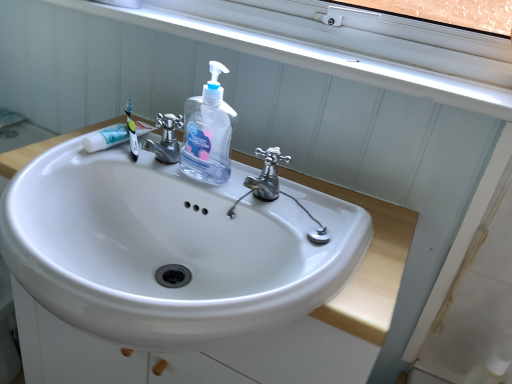
Question: Is black plastic toothbrush at upper left shorter than polished chrome tap at center, arranged as the 1th tap when viewed from the right?

Choices:
 (A) no
 (B) yes

Answer: (B)

Question: Considering the relative positions of black plastic toothbrush at upper left and polished chrome tap at center, placed as the second tap when sorted from left to right, in the image provided, is black plastic toothbrush at upper left to the right of polished chrome tap at center, placed as the second tap when sorted from left to right, from the viewer's perspective?

Choices:
 (A) no
 (B) yes

Answer: (A)

Question: Can you confirm if black plastic toothbrush at upper left is smaller than polished chrome tap at center, arranged as the 1th tap when viewed from the right?

Choices:
 (A) no
 (B) yes

Answer: (B)

Question: Does black plastic toothbrush at upper left lie behind polished chrome tap at center, arranged as the 1th tap when viewed from the right?

Choices:
 (A) no
 (B) yes

Answer: (B)

Question: Is polished chrome tap at center, arranged as the 1th tap when viewed from the right, surrounded by black plastic toothbrush at upper left?

Choices:
 (A) no
 (B) yes

Answer: (A)

Question: Is black plastic toothbrush at upper left taller than polished chrome tap at center, placed as the second tap when sorted from left to right?

Choices:
 (A) no
 (B) yes

Answer: (A)

Question: Is white plastic window sill at upper center positioned beyond the bounds of polished chrome tap at center, arranged as the 1th tap when viewed from the right?

Choices:
 (A) yes
 (B) no

Answer: (A)

Question: Does white plastic window sill at upper center have a smaller size compared to polished chrome tap at center, placed as the second tap when sorted from left to right?

Choices:
 (A) yes
 (B) no

Answer: (B)

Question: Is white plastic window sill at upper center facing towards polished chrome tap at center, arranged as the 1th tap when viewed from the right?

Choices:
 (A) no
 (B) yes

Answer: (A)

Question: Can polished chrome tap at center, placed as the second tap when sorted from left to right, be found inside white plastic window sill at upper center?

Choices:
 (A) no
 (B) yes

Answer: (A)

Question: Is white plastic window sill at upper center turned away from polished chrome tap at center, arranged as the 1th tap when viewed from the right?

Choices:
 (A) no
 (B) yes

Answer: (A)

Question: Does white plastic window sill at upper center have a lesser height compared to polished chrome tap at center, arranged as the 1th tap when viewed from the right?

Choices:
 (A) yes
 (B) no

Answer: (A)

Question: Is polished chrome tap at center, placed as the second tap when sorted from left to right, next to white plastic window sill at upper center?

Choices:
 (A) no
 (B) yes

Answer: (A)